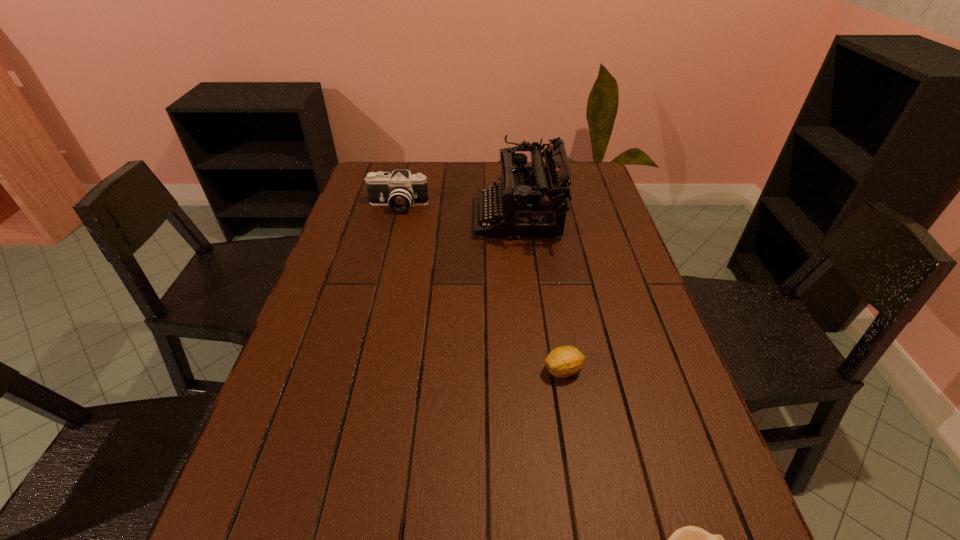
You are a GUI agent. You are given a task and a screenshot of the screen. Output one action in this format:
    pyautogui.click(x=<x>, y=<y>)
    Task: Click on the vacant area situated at the stem end of the third tallest object
    This screenshot has height=540, width=960.
    Given the screenshot: What is the action you would take?
    pyautogui.click(x=467, y=370)

Where is `vacant point located 0.160m at the stem end of the third tallest object`? This screenshot has height=540, width=960. vacant point located 0.160m at the stem end of the third tallest object is located at coordinates (470, 370).

Where is `object that is at the far edge`? The image size is (960, 540). object that is at the far edge is located at coordinates (533, 200).

The height and width of the screenshot is (540, 960). I want to click on object situated at the left edge, so coord(401,190).

In order to click on vacant space at the far edge of the desktop in this screenshot , I will do `click(444, 163)`.

Identify the location of vacant space at the left edge of the desktop. (353, 205).

Where is `free space at the right edge`? free space at the right edge is located at coordinates (625, 311).

The image size is (960, 540). What are the coordinates of `vacant space at the far left corner of the desktop` in the screenshot? It's located at (362, 190).

Identify the location of vacant area that lies between the tallest object and the second tallest object. (458, 212).

This screenshot has height=540, width=960. In order to click on free space between the second nearest object and the tallest object in this screenshot , I will do `click(541, 294)`.